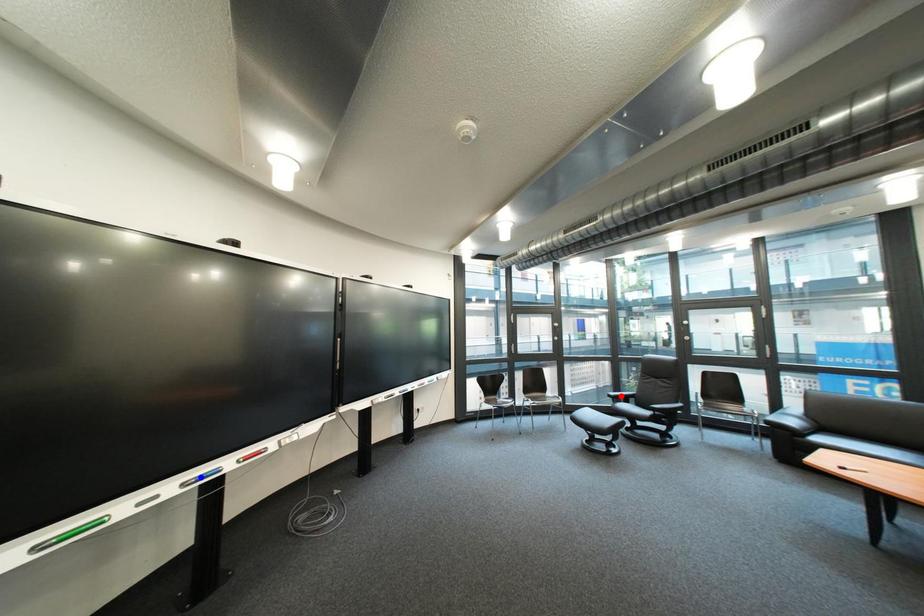
Question: Two points are marked on the image. Which point is closer to the camera?

Choices:
 (A) Blue point is closer.
 (B) Red point is closer.

Answer: (A)